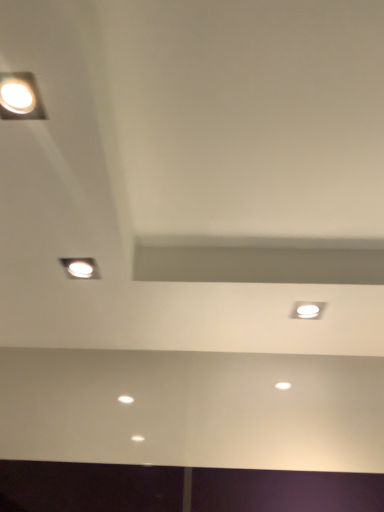
Measure the distance between point (318, 308) and camera.

Point (318, 308) is 3.68 feet away from camera.

The image size is (384, 512). I want to click on white glossy light fixture at upper right, so click(x=308, y=310).

Locate an element on the screen. This screenshot has width=384, height=512. matte silver lamp at upper left, which is counted as the second lamp, starting from the top is located at coordinates (80, 268).

You are a GUI agent. You are given a task and a screenshot of the screen. Output one action in this format:
    pyautogui.click(x=<x>, y=<y>)
    Task: Click on the white glossy light fixture at upper right
    Image resolution: width=384 pixels, height=512 pixels.
    Given the screenshot: What is the action you would take?
    pyautogui.click(x=308, y=310)

Is matte white light fixture at upper left, which is the 1th lamp from top to bottom, touching matte silver lamp at upper left, which is the 2th lamp in front-to-back order?

matte white light fixture at upper left, which is the 1th lamp from top to bottom, and matte silver lamp at upper left, which is the 2th lamp in front-to-back order, are clearly separated.

Identify the location of lamp that appears below the matte white light fixture at upper left, the second lamp in the bottom-to-top sequence (from a real-world perspective). (80, 268).

What's the angular difference between matte white light fixture at upper left, acting as the second lamp starting from the back, and matte silver lamp at upper left, which is counted as the second lamp, starting from the top,'s facing directions?

The angular difference between matte white light fixture at upper left, acting as the second lamp starting from the back, and matte silver lamp at upper left, which is counted as the second lamp, starting from the top, is 0 degrees.

Is matte white light fixture at upper left, the second lamp in the bottom-to-top sequence, oriented towards matte silver lamp at upper left, which ranks as the first lamp in bottom-to-top order?

No, matte white light fixture at upper left, the second lamp in the bottom-to-top sequence, is not turned towards matte silver lamp at upper left, which ranks as the first lamp in bottom-to-top order.

Considering the sizes of objects white glossy light fixture at upper right and matte white light fixture at upper left, the second lamp in the bottom-to-top sequence, in the image provided, who is taller, white glossy light fixture at upper right or matte white light fixture at upper left, the second lamp in the bottom-to-top sequence,?

With more height is matte white light fixture at upper left, the second lamp in the bottom-to-top sequence.

From a real-world perspective, does white glossy light fixture at upper right stand above matte white light fixture at upper left, the second lamp in the bottom-to-top sequence?

No.

Which is more to the left, white glossy light fixture at upper right or matte white light fixture at upper left, acting as the second lamp starting from the back?

matte white light fixture at upper left, acting as the second lamp starting from the back.

At what (x,y) coordinates should I click in order to perform the action: click on the 2nd lamp above when counting from the white glossy light fixture at upper right (from the image's perspective). Please return your answer as a coordinate pair (x, y). Looking at the image, I should click on (20, 97).

Is matte silver lamp at upper left, which is counted as the second lamp, starting from the top, taller than white glossy light fixture at upper right?

Yes.

What's the angular difference between matte silver lamp at upper left, placed as the 1th lamp when sorted from back to front, and white glossy light fixture at upper right's facing directions?

matte silver lamp at upper left, placed as the 1th lamp when sorted from back to front, and white glossy light fixture at upper right are facing 90 degrees away from each other.

Is there a large distance between matte silver lamp at upper left, which ranks as the first lamp in bottom-to-top order, and white glossy light fixture at upper right?

No, matte silver lamp at upper left, which ranks as the first lamp in bottom-to-top order, is in close proximity to white glossy light fixture at upper right.

Which object is thinner, matte silver lamp at upper left, which is counted as the second lamp, starting from the top, or white glossy light fixture at upper right?

Thinner between the two is white glossy light fixture at upper right.

Who is more distant, white glossy light fixture at upper right or matte silver lamp at upper left, which is the 2th lamp in front-to-back order?

white glossy light fixture at upper right.

From a real-world perspective, relative to matte silver lamp at upper left, which is counted as the second lamp, starting from the top, is white glossy light fixture at upper right vertically above or below?

In terms of real-world spatial position, white glossy light fixture at upper right is below matte silver lamp at upper left, which is counted as the second lamp, starting from the top.

Is white glossy light fixture at upper right far away from matte silver lamp at upper left, which is the 2th lamp in front-to-back order?

No, white glossy light fixture at upper right is in close proximity to matte silver lamp at upper left, which is the 2th lamp in front-to-back order.

Is there a large distance between matte silver lamp at upper left, which is the 2th lamp in front-to-back order, and matte white light fixture at upper left, which is the 1th lamp from top to bottom?

No.

Looking at their sizes, would you say matte silver lamp at upper left, which is counted as the second lamp, starting from the top, is wider or thinner than matte white light fixture at upper left, which is the 1th lamp from top to bottom?

matte silver lamp at upper left, which is counted as the second lamp, starting from the top, is thinner than matte white light fixture at upper left, which is the 1th lamp from top to bottom.

From the image's perspective, would you say matte silver lamp at upper left, placed as the 1th lamp when sorted from back to front, is positioned over matte white light fixture at upper left, the second lamp in the bottom-to-top sequence?

No, from the image's perspective, matte silver lamp at upper left, placed as the 1th lamp when sorted from back to front, is not over matte white light fixture at upper left, the second lamp in the bottom-to-top sequence.

Consider the image. Between matte silver lamp at upper left, which ranks as the first lamp in bottom-to-top order, and matte white light fixture at upper left, which is the 1th lamp from top to bottom, which one is positioned in front?

matte white light fixture at upper left, which is the 1th lamp from top to bottom, is closer to the camera.

Does matte white light fixture at upper left, the second lamp in the bottom-to-top sequence, touch white glossy light fixture at upper right?

No, matte white light fixture at upper left, the second lamp in the bottom-to-top sequence, is not making contact with white glossy light fixture at upper right.

Is matte white light fixture at upper left, which is the 1th lamp from top to bottom, oriented towards white glossy light fixture at upper right?

No, matte white light fixture at upper left, which is the 1th lamp from top to bottom, is not oriented towards white glossy light fixture at upper right.

Is matte white light fixture at upper left, which is the 1th lamp from top to bottom, surrounding white glossy light fixture at upper right?

That's incorrect, white glossy light fixture at upper right is not inside matte white light fixture at upper left, which is the 1th lamp from top to bottom.

At what (x,y) coordinates should I click in order to perform the action: click on lamp on the left side of matte silver lamp at upper left, placed as the 1th lamp when sorted from back to front. Please return your answer as a coordinate pair (x, y). Looking at the image, I should click on (20, 97).

I want to click on lamp that is the 2nd object located in front of the white glossy light fixture at upper right, so click(x=20, y=97).

In the scene shown: From the image, which object appears to be farther from matte silver lamp at upper left, which is counted as the second lamp, starting from the top, white glossy light fixture at upper right or matte white light fixture at upper left, which is the 1th lamp from top to bottom?

white glossy light fixture at upper right is further to matte silver lamp at upper left, which is counted as the second lamp, starting from the top.

Which object lies nearer to the anchor point matte silver lamp at upper left, which ranks as the first lamp in bottom-to-top order, matte white light fixture at upper left, acting as the second lamp starting from the back, or white glossy light fixture at upper right?

Based on the image, matte white light fixture at upper left, acting as the second lamp starting from the back, appears to be nearer to matte silver lamp at upper left, which ranks as the first lamp in bottom-to-top order.

From the image, which object appears to be nearer to matte white light fixture at upper left, the 1th lamp in the front-to-back sequence, matte silver lamp at upper left, which is counted as the second lamp, starting from the top, or white glossy light fixture at upper right?

Among the two, matte silver lamp at upper left, which is counted as the second lamp, starting from the top, is located nearer to matte white light fixture at upper left, the 1th lamp in the front-to-back sequence.

From the image, which object appears to be nearer to white glossy light fixture at upper right, matte white light fixture at upper left, which is the 1th lamp from top to bottom, or matte silver lamp at upper left, which is counted as the second lamp, starting from the top?

matte silver lamp at upper left, which is counted as the second lamp, starting from the top, lies closer to white glossy light fixture at upper right than the other object.

Based on their spatial positions, is white glossy light fixture at upper right or matte silver lamp at upper left, which is counted as the second lamp, starting from the top, closer to matte white light fixture at upper left, the second lamp in the bottom-to-top sequence?

The object closer to matte white light fixture at upper left, the second lamp in the bottom-to-top sequence, is matte silver lamp at upper left, which is counted as the second lamp, starting from the top.

Which object lies further to the anchor point white glossy light fixture at upper right, matte silver lamp at upper left, which is counted as the second lamp, starting from the top, or matte white light fixture at upper left, acting as the second lamp starting from the back?

Based on the image, matte white light fixture at upper left, acting as the second lamp starting from the back, appears to be further to white glossy light fixture at upper right.

The width and height of the screenshot is (384, 512). I want to click on lamp between matte white light fixture at upper left, the 1th lamp in the front-to-back sequence, and white glossy light fixture at upper right, in the horizontal direction, so click(80, 268).